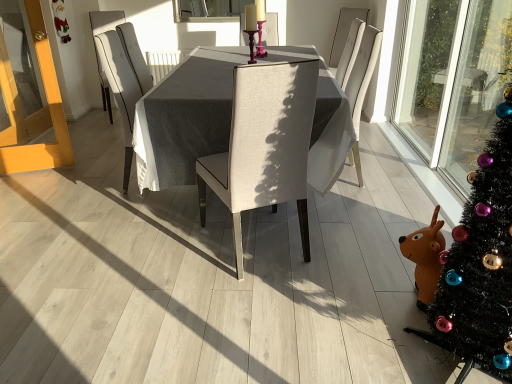
Question: Is beige fabric chair at center, the first chair from the front, in front of or behind textured gray table at center in the image?

Choices:
 (A) front
 (B) behind

Answer: (A)

Question: From the image's perspective, is beige fabric chair at center, the first chair from the front, positioned above or below textured gray table at center?

Choices:
 (A) above
 (B) below

Answer: (B)

Question: Estimate the real-world distances between objects in this image. Which object is farther from the beige fabric chair at center, the 2th chair from the right?

Choices:
 (A) light wood screen door at left
 (B) light beige fabric chair at center, the third chair positioned from the left
 (C) textured gray table at center
 (D) clear glass window screen at upper center
 (E) black artificial christmas tree at right

Answer: (D)

Question: Based on their relative distances, which object is farther from the beige fabric chair at center, which is counted as the 3th chair, starting from the back?

Choices:
 (A) textured gray table at center
 (B) light beige fabric chair at center, the second chair viewed from the back
 (C) black artificial christmas tree at right
 (D) light wood screen door at left
 (E) clear glass window screen at upper center

Answer: (E)